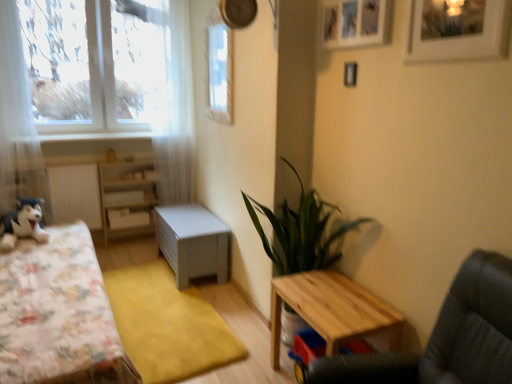
I want to click on free space above wooden table at lower right, placed as the first table when sorted from front to back (from a real-world perspective), so click(x=337, y=289).